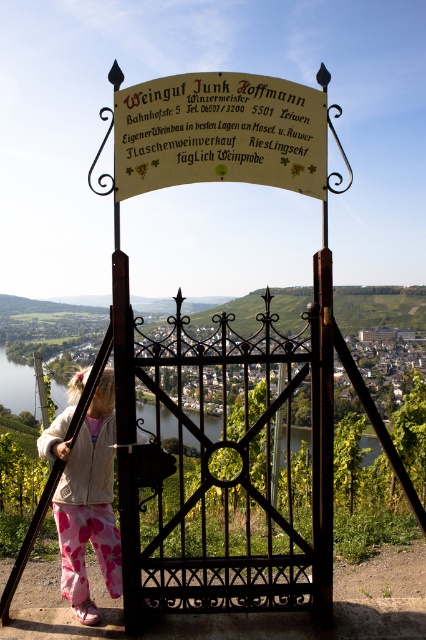
You are a visitor arriving at the vineyard and want to know if you can see both the black wrought iron gate at center and the wooden sign at center from your current position. Can you see both?

Yes, you can see both the black wrought iron gate at center and the wooden sign at center because the black wrought iron gate at center is bigger than the wooden sign at center, so it doesn not block the view of the smaller sign.